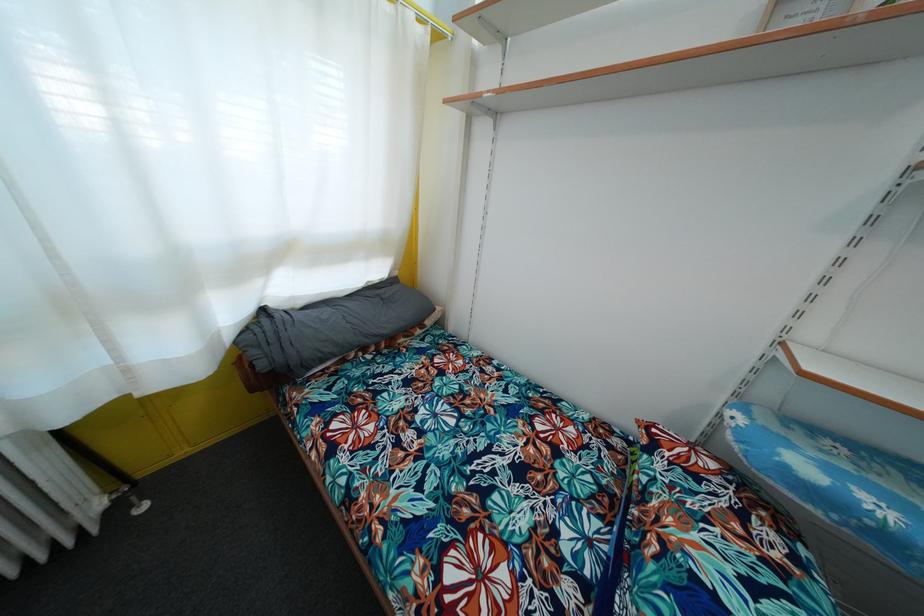
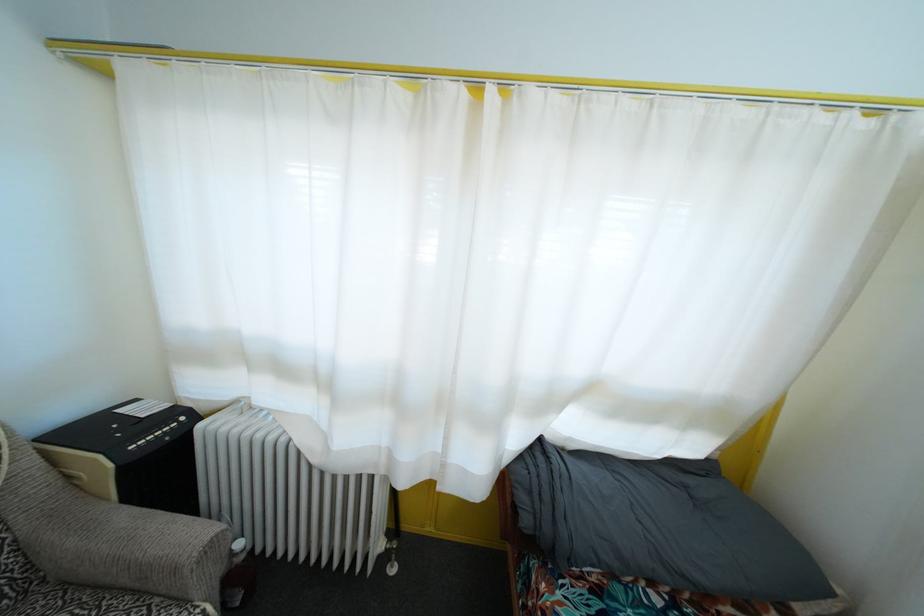
Where in the second image is the point corresponding to the point at 265,371 from the first image?

(529, 528)